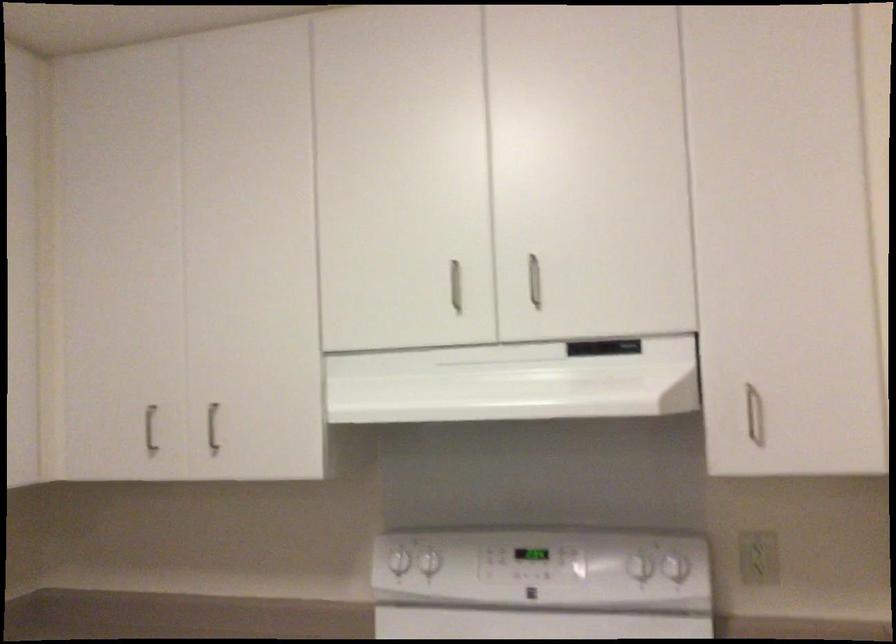
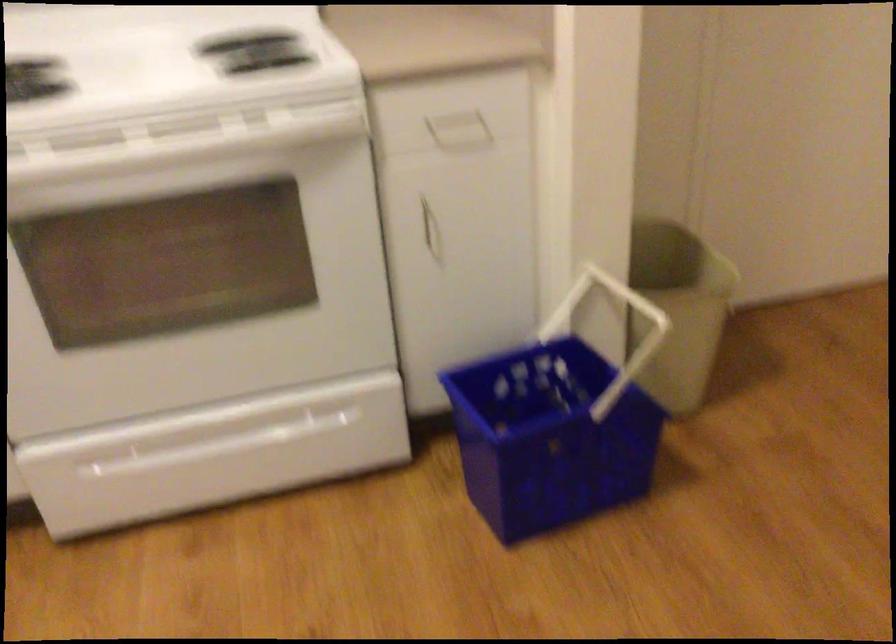
The first image is from the beginning of the video and the second image is from the end. How did the camera likely rotate when shooting the video?

The rotation direction of the camera is right-down.